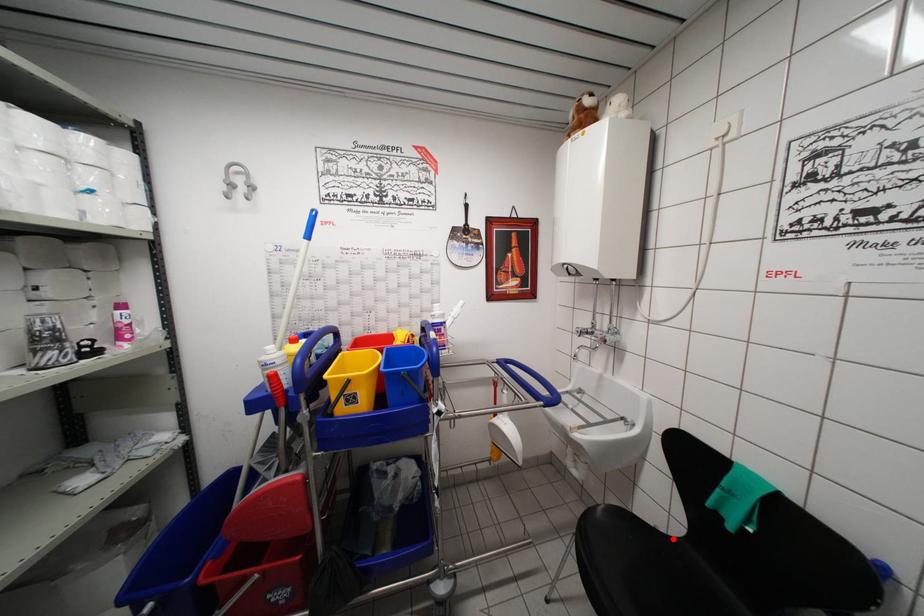
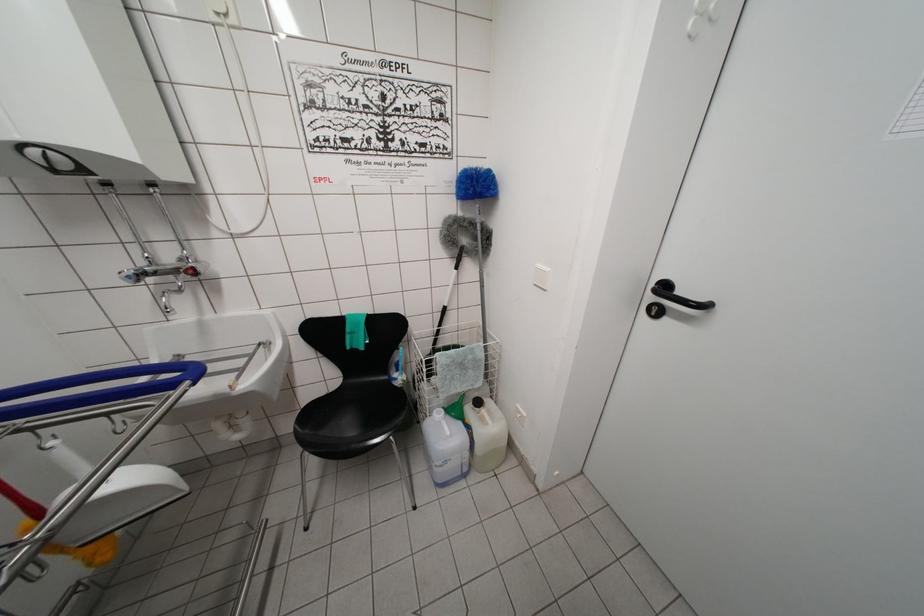
The point at the highlighted location is marked in the first image. Where is the corresponding point in the second image?

(335, 395)